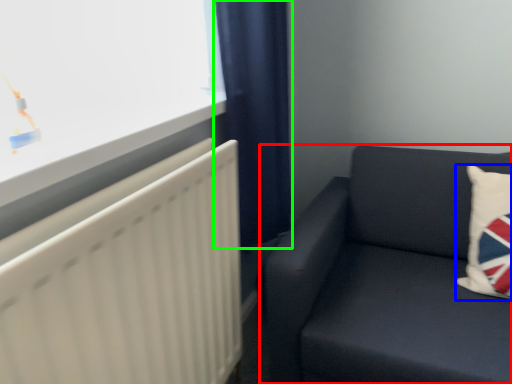
Question: Which object is the farthest from studio couch (highlighted by a red box)? Choose among these: pillow (highlighted by a blue box) or curtain (highlighted by a green box).

Choices:
 (A) pillow
 (B) curtain

Answer: (B)